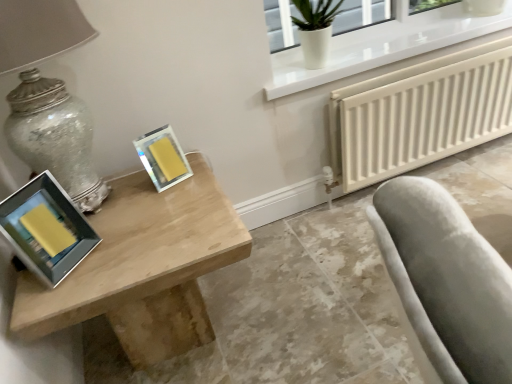
Question: From their relative heights in the image, would you say white textured radiator at lower right is taller or shorter than white glossy glass vase at upper right?

Choices:
 (A) short
 (B) tall

Answer: (B)

Question: Is white textured radiator at lower right inside or outside of white glossy glass vase at upper right?

Choices:
 (A) inside
 (B) outside

Answer: (B)

Question: Considering the real-world distances, which object is farthest from the white glossy glass vase at upper right?

Choices:
 (A) matte glass table lamp at left
 (B) yellow matte picture frame at upper center, which is counted as the 1th picture frame, starting from the right
 (C) light wood table at left
 (D) white textured radiator at lower right
 (E) matte yellow picture frame at left, the first picture frame from the left

Answer: (E)

Question: Which is farther from the matte yellow picture frame at left, marked as the 2th picture frame in a right-to-left arrangement?

Choices:
 (A) white textured radiator at lower right
 (B) light wood table at left
 (C) white glossy glass vase at upper right
 (D) matte glass table lamp at left
 (E) yellow matte picture frame at upper center, which is the first picture frame from back to front

Answer: (A)